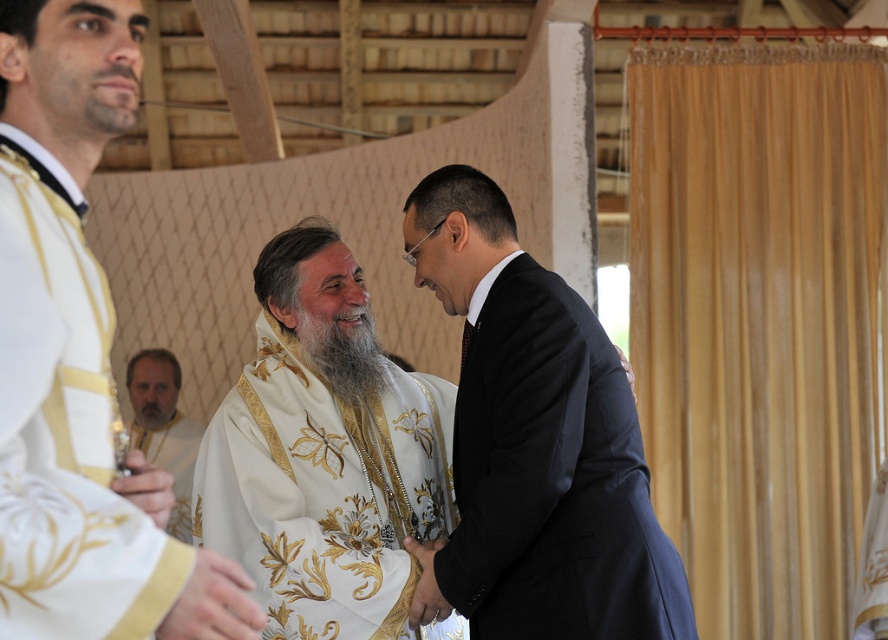
Question: Which point is closer to the camera taking this photo?

Choices:
 (A) (186, 605)
 (B) (148, 497)

Answer: (A)

Question: Does white embroidered robe at left appear over white satin hand at center?

Choices:
 (A) no
 (B) yes

Answer: (B)

Question: Is graywoollybeard at center to the right of white silk handkerchief at lower left from the viewer's perspective?

Choices:
 (A) yes
 (B) no

Answer: (A)

Question: Which object is positioned closest to the white embroidered robe at left?

Choices:
 (A) white embroidered robe at center
 (B) dark blue wool suit at center

Answer: (B)

Question: Does white embroidered robe at center appear on the right side of white silk robe at lower left?

Choices:
 (A) yes
 (B) no

Answer: (A)

Question: Which object is the closest to the white silk robe at lower left?

Choices:
 (A) graywoollybeard at center
 (B) white satin hand at center

Answer: (A)